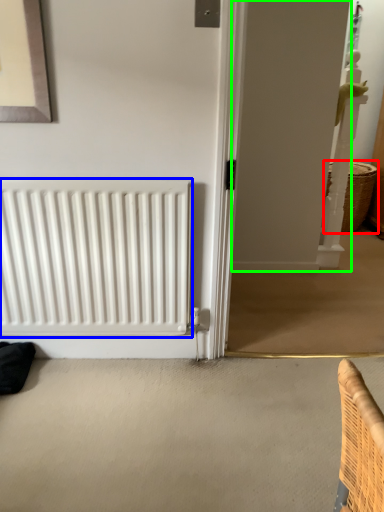
Question: Which object is the farthest from basket (highlighted by a red box)? Choose among these: radiator (highlighted by a blue box) or screen door (highlighted by a green box).

Choices:
 (A) radiator
 (B) screen door

Answer: (A)